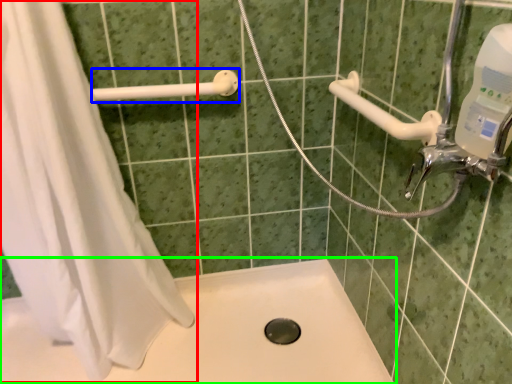
Question: Considering the real-world distances, which object is farthest from shower curtain (highlighted by a red box)? shower (highlighted by a blue box) or bath (highlighted by a green box)?

Choices:
 (A) shower
 (B) bath

Answer: (A)